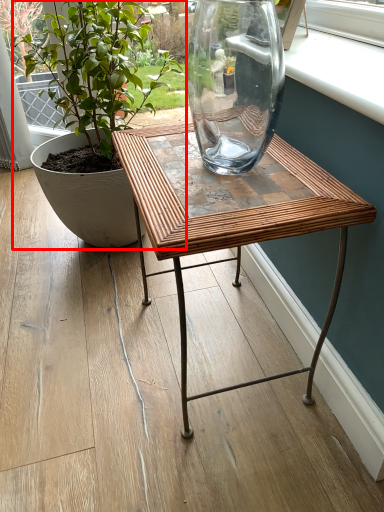
Question: Considering the relative positions of houseplant (annotated by the red box) and table in the image provided, where is houseplant (annotated by the red box) located with respect to the staircase?

Choices:
 (A) left
 (B) right

Answer: (A)